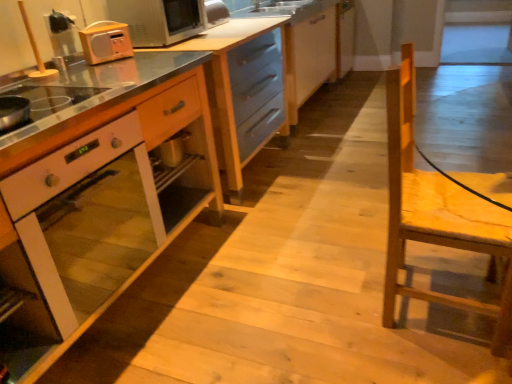
Where is `free location to the right of white glossy oven at center`? This screenshot has width=512, height=384. free location to the right of white glossy oven at center is located at coordinates (276, 268).